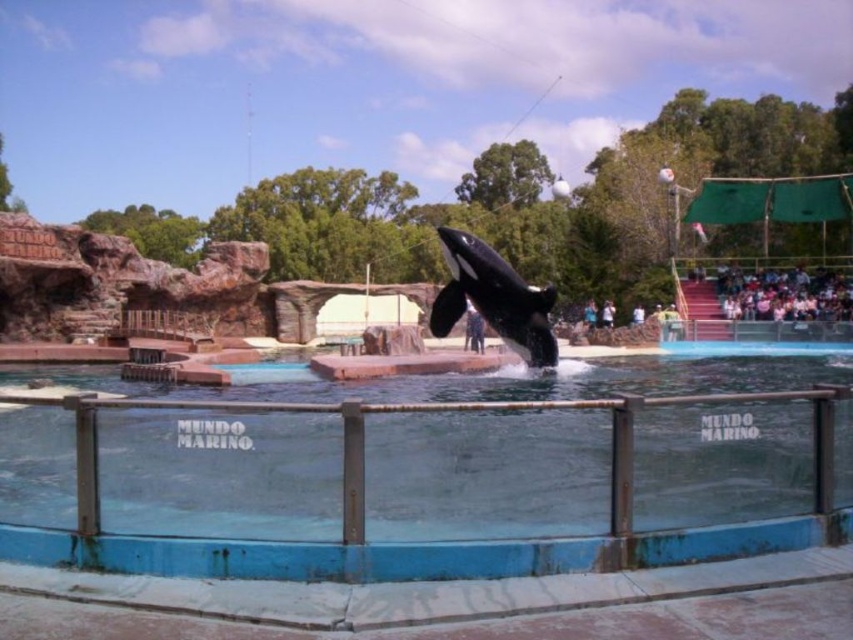
You are a marine biologist observing the killer whale at Mundo Marino. The blue plastic pool at center and the black smooth orca at center are in your view. Which object is shorter in height?

The blue plastic pool at center is shorter in height compared to the black smooth orca at center.